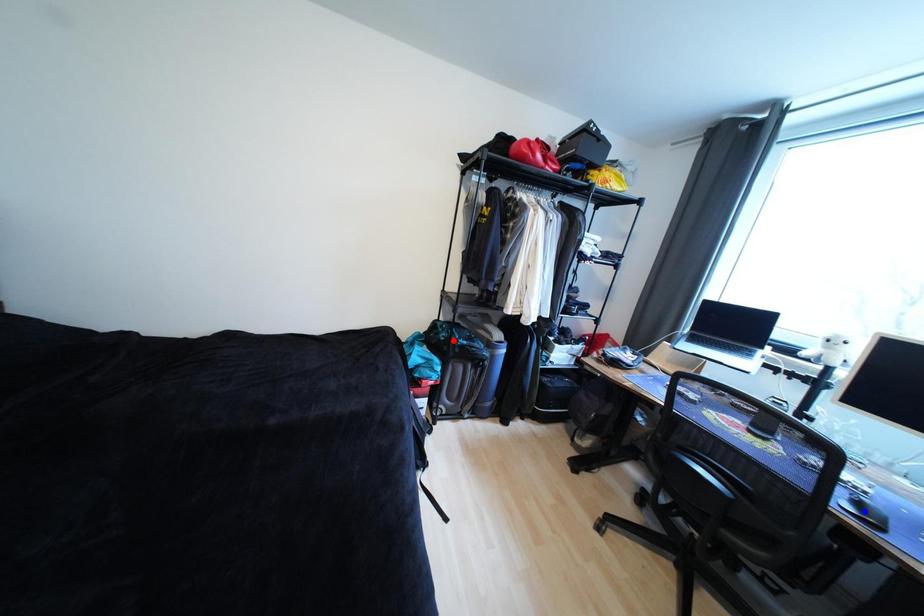
Question: Which of the two points in the image is closer to the camera?

Choices:
 (A) Blue point is closer.
 (B) Red point is closer.

Answer: (A)